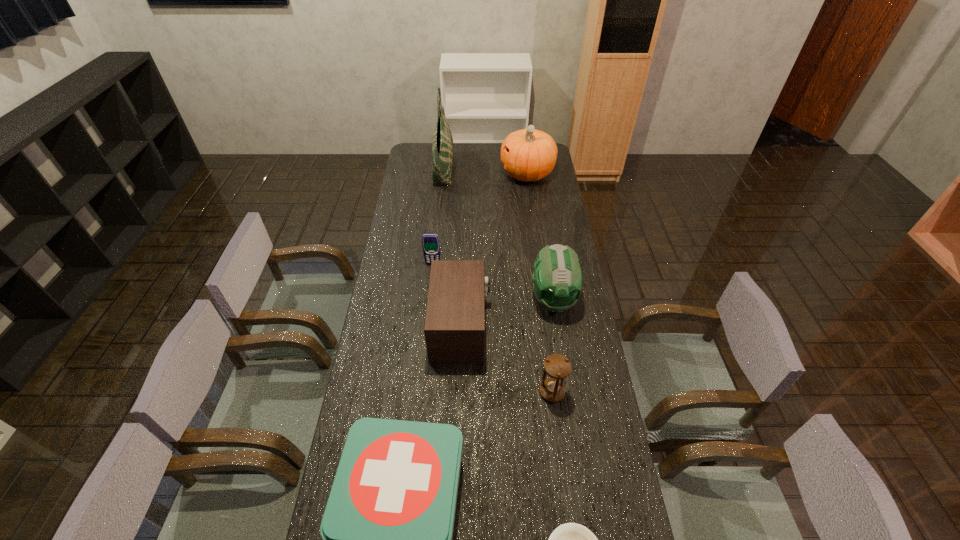
Find the location of `free space that satisfies the following two spatial constraints: 1. on the front-facing side of the second tallest object; 2. on the front-facing side of the cellular telephone`. free space that satisfies the following two spatial constraints: 1. on the front-facing side of the second tallest object; 2. on the front-facing side of the cellular telephone is located at coordinates (540, 264).

Where is `free space that satisfies the following two spatial constraints: 1. on the visor of the football helmet; 2. on the front-facing side of the radio receiver`? The image size is (960, 540). free space that satisfies the following two spatial constraints: 1. on the visor of the football helmet; 2. on the front-facing side of the radio receiver is located at coordinates (558, 327).